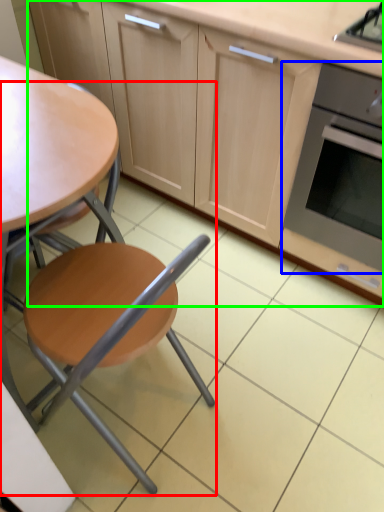
Question: Considering the real-world distances, which object is farthest from chair (highlighted by a red box)? kitchen appliance (highlighted by a blue box) or cabinetry (highlighted by a green box)?

Choices:
 (A) kitchen appliance
 (B) cabinetry

Answer: (B)